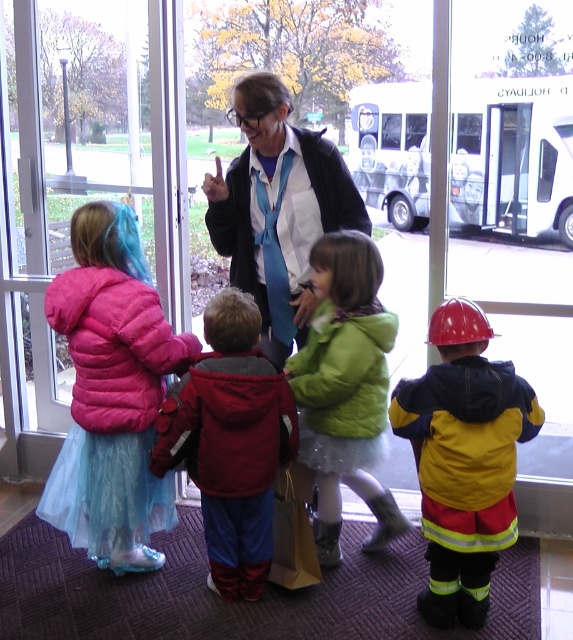
You are a costume designer preparing for a play and need to know the relative sizes of the costumes. Which costume has a wider jacket, the yellow matte jacket at center or the red fleece jacket at center?

The red fleece jacket at center is wider than the yellow matte jacket at center.

You are a photographer trying to capture a clear photo of the green fuzzy jacket at center without the yellow matte jacket at center blocking it. What should you do?

The yellow matte jacket at center is in front of the green fuzzy jacket at center, so you should move the yellow matte jacket at center out of the way to get a clear shot of the green fuzzy jacket at center.

You are standing in the middle of the room and see a point marked at coordinates (464,460). What object is located at that point?

The point at coordinates (464,460) indicates the location of the yellow matte jacket at center.